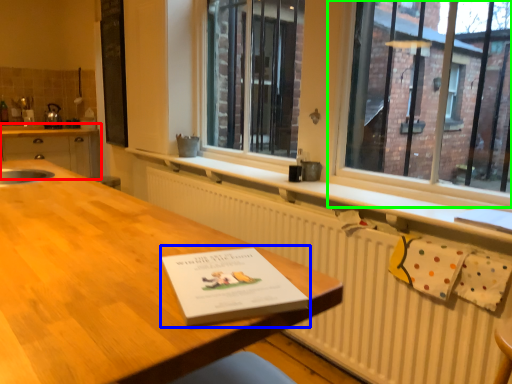
Question: Which is nearer to the cabinetry (highlighted by a red box)? paperback book (highlighted by a blue box) or window (highlighted by a green box).

Choices:
 (A) paperback book
 (B) window

Answer: (B)